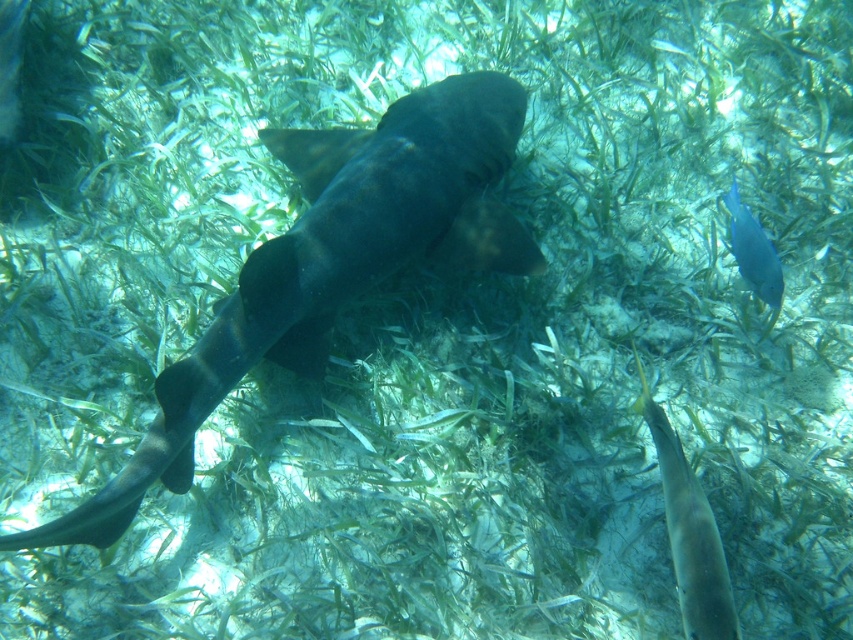
You are a scuba diver exploring this underwater scene. You notice a translucent yellowish fish at lower right and a blue glossy fish at upper right. Which fish appears larger to you?

The translucent yellowish fish at lower right appears larger because it is closer to the viewer than the blue glossy fish at upper right.

You are a marine biologist observing this underwater scene. You notice the dark gray matte shark at center and the blue glossy fish at upper right. Which object is positioned higher in the water column?

The blue glossy fish at upper right is positioned higher in the water column than the dark gray matte shark at center.